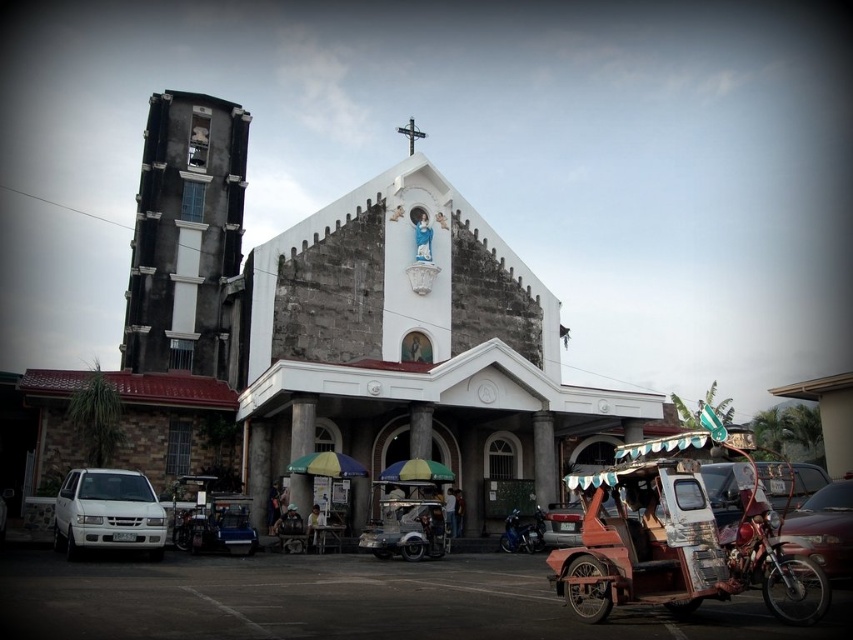
You are a pedestrian standing at the entrance of the church. You want to walk to the shiny blue motorcycle at lower center. Is the matte red car at lower right blocking your path?

The matte red car at lower right is above the shiny blue motorcycle at lower center, so it is not blocking the path to the motorcycle.

You are standing in front of the church and notice two points marked on the bell tower. The first point is at coordinates point (x=817, y=493) and the second at point (x=607, y=506). Which point is closer to you?

Point (x=607, y=506) is closer to you because it is less further to the camera than point (x=817, y=493).

You are a delivery person who needs to park your vehicle. You see a metallic silver tricycle at center and a matte red car at lower right. Which vehicle takes up less space in the parking lot?

The metallic silver tricycle at center has a smaller size compared to the matte red car at lower right, so it takes up less space in the parking lot.